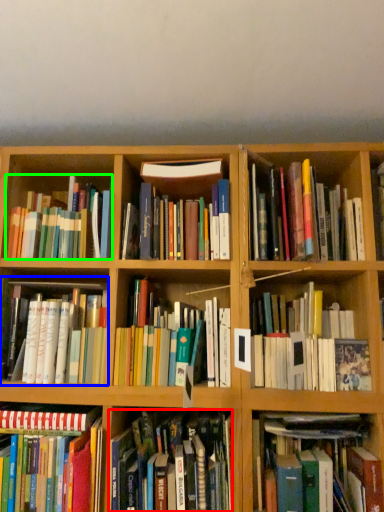
Question: Estimate the real-world distances between objects in this image. Which object is closer to book (highlighted by a red box), book (highlighted by a blue box) or book (highlighted by a green box)?

Choices:
 (A) book
 (B) book

Answer: (A)